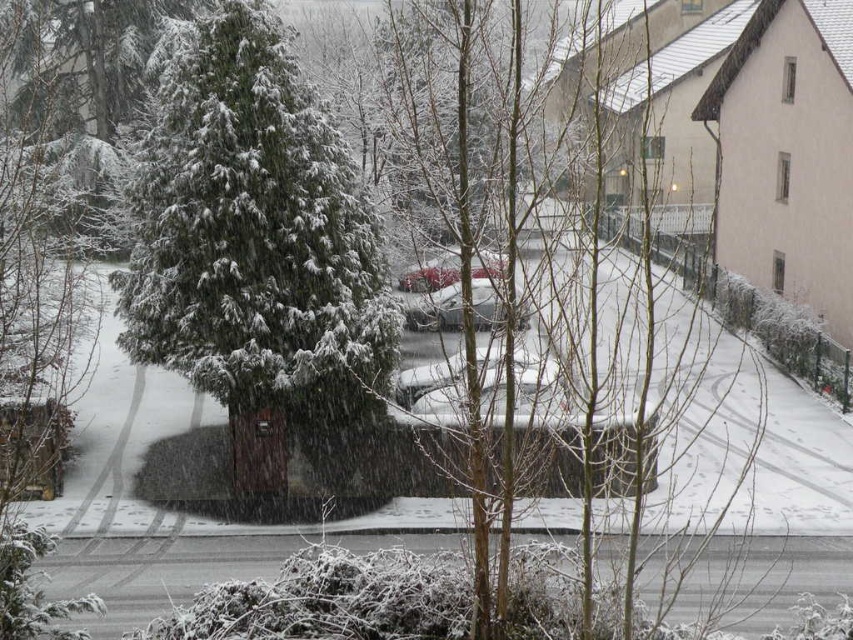
Question: Does shiny silver car at center have a larger size compared to metallic red car at center?

Choices:
 (A) no
 (B) yes

Answer: (A)

Question: Which of the following is the closest to the observer?

Choices:
 (A) (263, 349)
 (B) (486, 296)
 (C) (477, 264)

Answer: (C)

Question: Which of these objects is positioned farthest from the green matte evergreen tree at left?

Choices:
 (A) shiny silver car at center
 (B) metallic red car at center

Answer: (B)

Question: Which point is farther to the camera?

Choices:
 (A) (419, 305)
 (B) (453, 275)
 (C) (349, 308)

Answer: (B)

Question: Is green matte evergreen tree at left above shiny silver car at center?

Choices:
 (A) yes
 (B) no

Answer: (B)

Question: Does green matte evergreen tree at left appear on the left side of metallic red car at center?

Choices:
 (A) no
 (B) yes

Answer: (B)